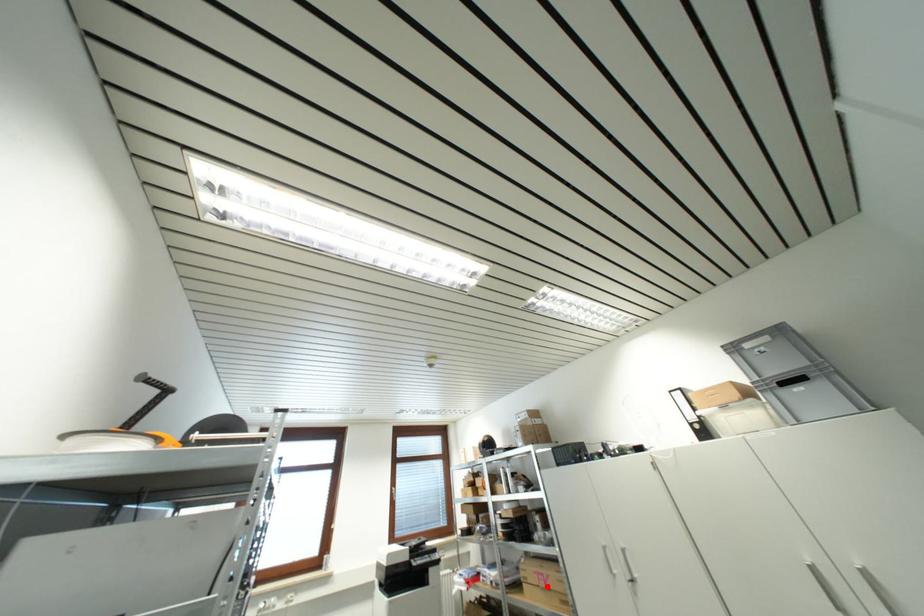
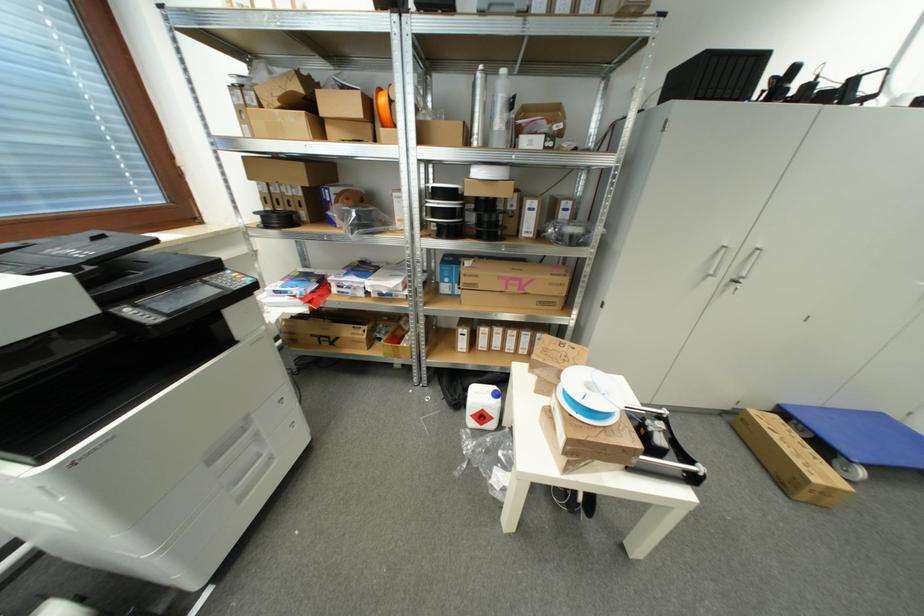
In the second image, find the point that corresponds to the highlighted location in the first image.

(517, 292)